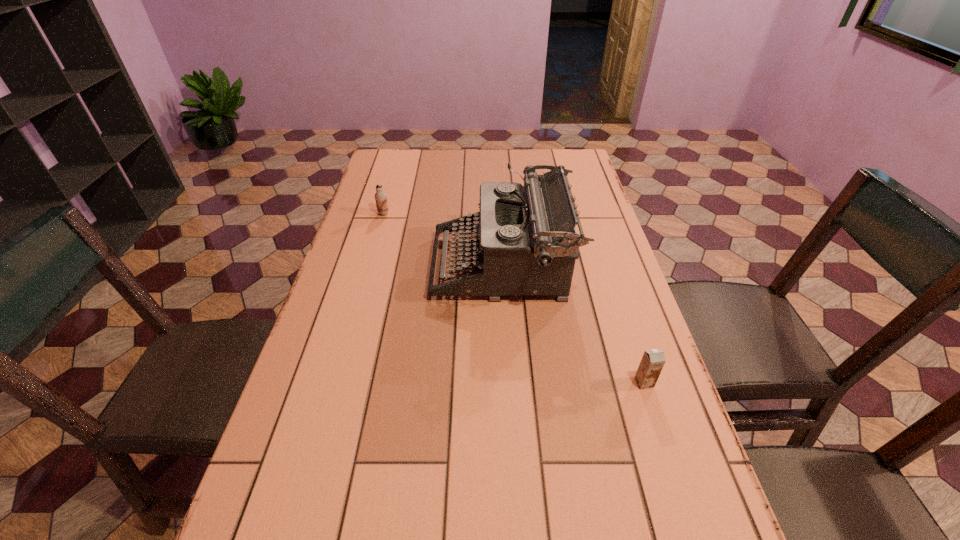
Find the location of a particular element. Image resolution: width=960 pixels, height=540 pixels. vacant space in between the tallest object and the nearest object is located at coordinates (573, 325).

Locate an element on the screen. The width and height of the screenshot is (960, 540). free space between the tallest object and the nearer chocolate milk is located at coordinates (573, 325).

You are a GUI agent. You are given a task and a screenshot of the screen. Output one action in this format:
    pyautogui.click(x=<x>, y=<y>)
    Task: Click on the vacant space in between the right chocolate milk and the typewriter
    The image size is (960, 540).
    Given the screenshot: What is the action you would take?
    pyautogui.click(x=573, y=325)

Locate an element on the screen. free spot between the nearer chocolate milk and the left chocolate milk is located at coordinates (514, 298).

Identify the location of blank region between the nearest object and the leftmost object. tap(514, 298).

Find the location of `unoccupied position between the nearer chocolate milk and the farthest object`. unoccupied position between the nearer chocolate milk and the farthest object is located at coordinates (514, 298).

Where is `free spot between the right chocolate milk and the leftmost object`? free spot between the right chocolate milk and the leftmost object is located at coordinates (514, 298).

Locate which object ranks second in proximity to the rightmost object. Please provide its 2D coordinates. Your answer should be formatted as a tuple, i.e. [(x, y)], where the tuple contains the x and y coordinates of a point satisfying the conditions above.

[(380, 196)]

Locate which object ranks second in proximity to the leftmost object. Please provide its 2D coordinates. Your answer should be formatted as a tuple, i.e. [(x, y)], where the tuple contains the x and y coordinates of a point satisfying the conditions above.

[(652, 362)]

Image resolution: width=960 pixels, height=540 pixels. In order to click on vacant region that satisfies the following two spatial constraints: 1. on the typing side of the second farthest object; 2. on the back side of the rightmost object in this screenshot , I will do click(x=509, y=383).